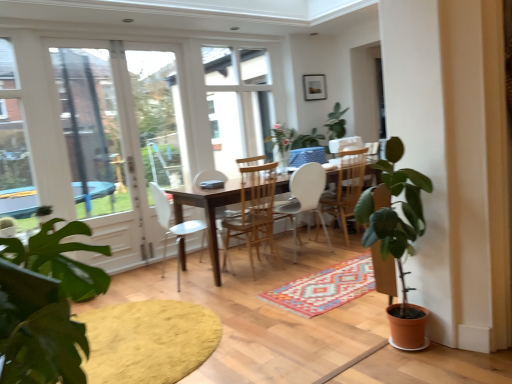
Question: From a real-world perspective, is yellow textured rug at lower left on clear glass screen door at left?

Choices:
 (A) yes
 (B) no

Answer: (B)

Question: From the image's perspective, would you say yellow textured rug at lower left is shown under clear glass screen door at left?

Choices:
 (A) yes
 (B) no

Answer: (A)

Question: Is yellow textured rug at lower left not close to clear glass screen door at left?

Choices:
 (A) no
 (B) yes

Answer: (B)

Question: Is yellow textured rug at lower left thinner than clear glass screen door at left?

Choices:
 (A) yes
 (B) no

Answer: (B)

Question: Considering the relative sizes of yellow textured rug at lower left and clear glass screen door at left in the image provided, is yellow textured rug at lower left taller than clear glass screen door at left?

Choices:
 (A) no
 (B) yes

Answer: (A)

Question: Can you confirm if yellow textured rug at lower left is wider than clear glass screen door at left?

Choices:
 (A) no
 (B) yes

Answer: (B)

Question: Is matte wooden picture frame at upper center outside of white plastic chair at center, the 4th chair in the right-to-left sequence?

Choices:
 (A) no
 (B) yes

Answer: (B)

Question: Is matte wooden picture frame at upper center taller than white plastic chair at center, the 4th chair in the right-to-left sequence?

Choices:
 (A) no
 (B) yes

Answer: (A)

Question: From the image's perspective, is matte wooden picture frame at upper center above white plastic chair at center, the 4th chair in the right-to-left sequence?

Choices:
 (A) no
 (B) yes

Answer: (B)

Question: From a real-world perspective, is matte wooden picture frame at upper center positioned over white plastic chair at center, arranged as the 1th chair when viewed from the left, based on gravity?

Choices:
 (A) yes
 (B) no

Answer: (A)

Question: From the image's perspective, does matte wooden picture frame at upper center appear lower than white plastic chair at center, arranged as the 1th chair when viewed from the left?

Choices:
 (A) no
 (B) yes

Answer: (A)

Question: Does matte wooden picture frame at upper center have a greater width compared to white plastic chair at center, the 4th chair in the right-to-left sequence?

Choices:
 (A) yes
 (B) no

Answer: (B)

Question: Considering the relative sizes of yellow textured rug at lower left and terracotta pot plant at right in the image provided, is yellow textured rug at lower left shorter than terracotta pot plant at right?

Choices:
 (A) yes
 (B) no

Answer: (A)